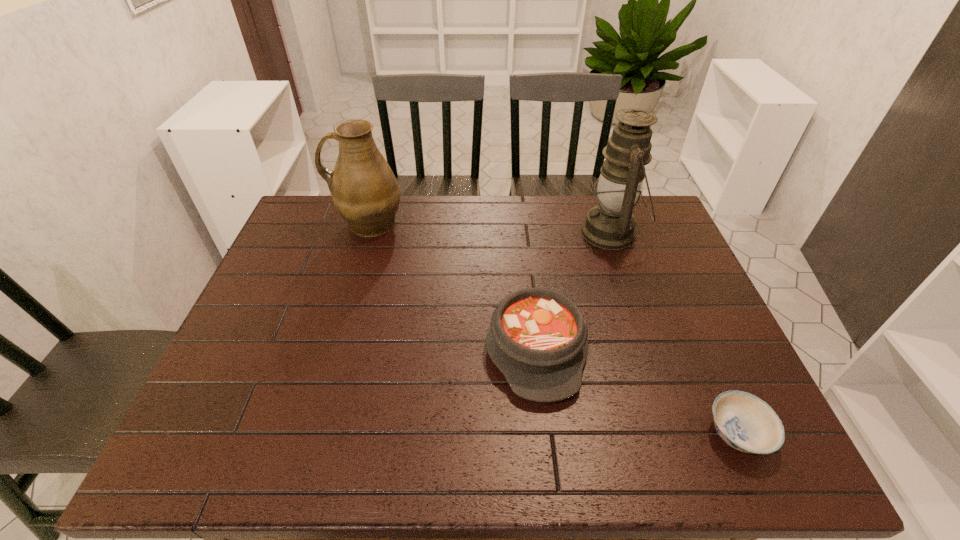
Where is `free area in between the pitcher and the second shortest object`? The height and width of the screenshot is (540, 960). free area in between the pitcher and the second shortest object is located at coordinates (452, 285).

This screenshot has width=960, height=540. Find the location of `free spot between the shortest object and the second shortest object`. free spot between the shortest object and the second shortest object is located at coordinates (636, 390).

Find the location of a particular element. free space between the casserole and the leftmost object is located at coordinates (452, 285).

What are the coordinates of `free point between the pitcher and the oil lamp` in the screenshot? It's located at (490, 228).

I want to click on object that is the second nearest to the tallest object, so click(745, 422).

You are a GUI agent. You are given a task and a screenshot of the screen. Output one action in this format:
    pyautogui.click(x=<x>, y=<y>)
    Task: Click on the object that is the nearest to the shortest object
    The height and width of the screenshot is (540, 960).
    Given the screenshot: What is the action you would take?
    pyautogui.click(x=537, y=338)

Find the location of a particular element. The width and height of the screenshot is (960, 540). vacant space that satisfies the following two spatial constraints: 1. on the front side of the shortest object; 2. on the left side of the third tallest object is located at coordinates (545, 433).